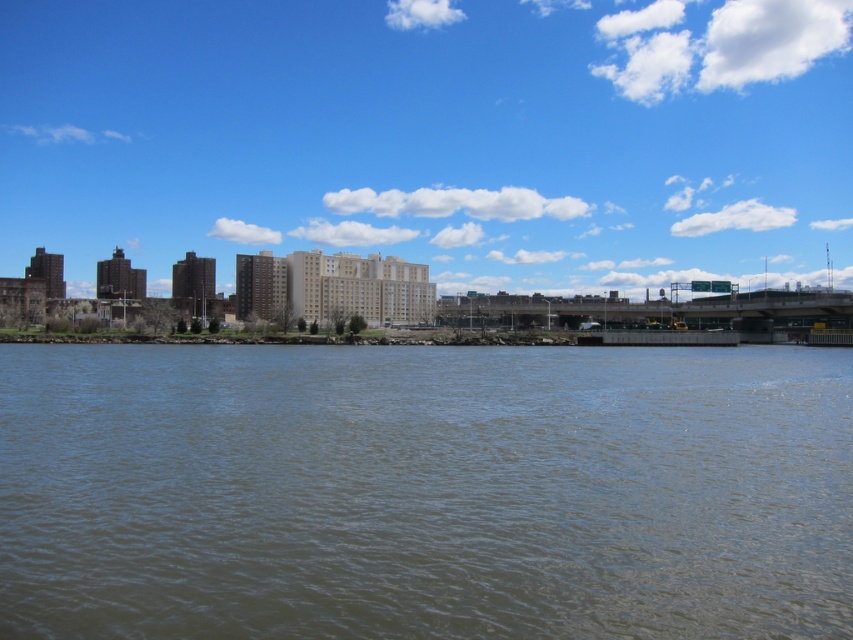
Which of these two, brown water at lower center or matte concrete buildings at center, stands shorter?

brown water at lower center is shorter.

Can you confirm if brown water at lower center is positioned below matte concrete buildings at center?

A: Yes, brown water at lower center is below matte concrete buildings at center.

Is point (74, 349) behind point (277, 102)?

That is False.

At what (x,y) coordinates should I click in order to perform the action: click on brown water at lower center. Please return your answer as a coordinate pair (x, y). This screenshot has height=640, width=853. Looking at the image, I should click on (424, 492).